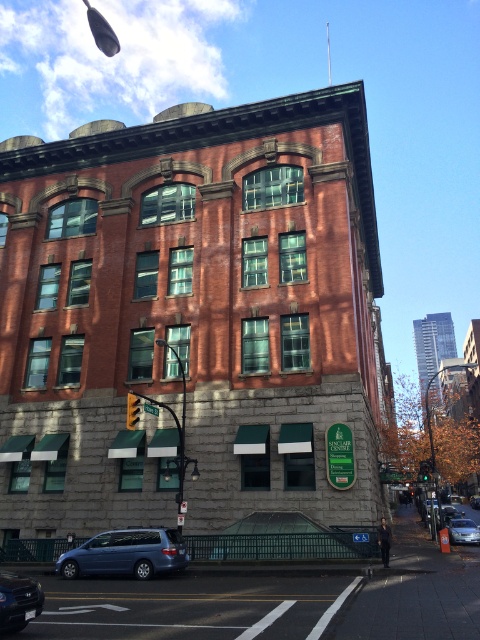
Question: From the image, what is the correct spatial relationship of metallic blue minivan at lower left in relation to silver metallic sedan at lower right?

Choices:
 (A) left
 (B) right

Answer: (A)

Question: Which point is farther from the camera taking this photo?

Choices:
 (A) (73, 548)
 (B) (6, 593)

Answer: (A)

Question: Does metallic blue minivan at lower left appear on the left side of silver metallic sedan at lower right?

Choices:
 (A) yes
 (B) no

Answer: (A)

Question: Which is farther from the silver metallic sedan at lower right?

Choices:
 (A) metallic blue minivan at lower left
 (B) matte black sedan at lower left

Answer: (B)

Question: Which point is farther to the camera?

Choices:
 (A) silver metallic sedan at lower right
 (B) metallic blue minivan at lower left

Answer: (A)

Question: Can you confirm if metallic blue minivan at lower left is thinner than matte black sedan at lower left?

Choices:
 (A) no
 (B) yes

Answer: (A)